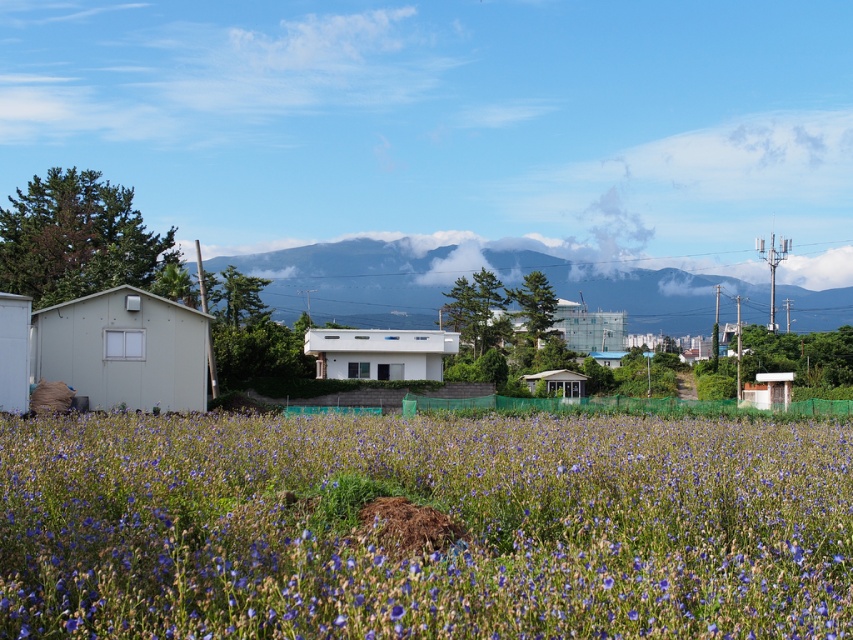
You are standing in the middle of the field of purple flowers and want to take a photo that includes both the shed and the house. The shed is located at point (13, 349) and the house is at point (556, 390). Which structure will appear larger in the photo?

The shed at point (13, 349) will appear larger in the photo because it is closer to the camera than the house at point (556, 390).

You are standing in the field of blue matte flowers at center and want to reach the matte gray hut at left. Which direction should you walk to get there?

The blue matte flowers at center are in front of the matte gray hut at left, so you should walk backward to reach the matte gray hut at left.

You are planning to install a wireless sensor between the white matte hut at left and the white matte hut at center to monitor the field. The sensor has a maximum range of 60 meters. Will it be able to connect both huts?

The white matte hut at left is 62.94 meters from the white matte hut at center. Since the sensor has a maximum range of 60 meters, it will not be able to connect both huts as the distance exceeds the sensor range.